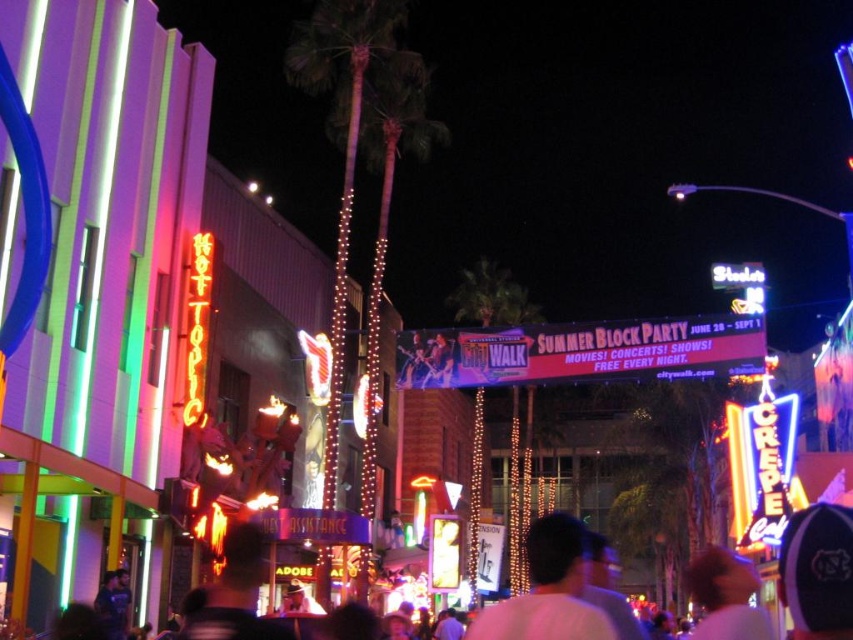
Based on the photo, you are standing at the point marked by the coordinates point [817,572] in the image. What is the closest object to you?

The closest object to you is the white cotton crowd at center, as the coordinates point [817,572] marks its location.

You are standing at point [544,580] and want to walk towards point [701,579]. Will the path be blocked by any objects in front of you?

The point [701,579] is behind point [544,580], so walking towards it would mean moving away from your current position. Therefore, there are no objects in front of you blocking the path.